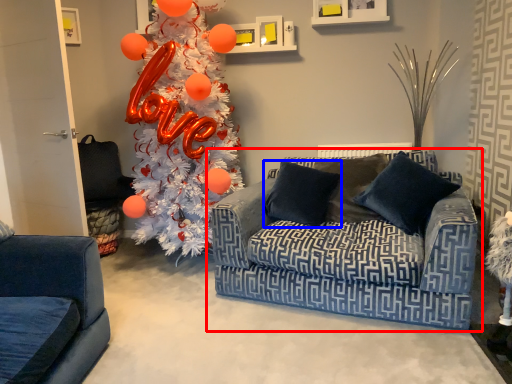
Question: Among these objects, which one is nearest to the camera, studio couch (highlighted by a red box) or pillow (highlighted by a blue box)?

Choices:
 (A) studio couch
 (B) pillow

Answer: (A)